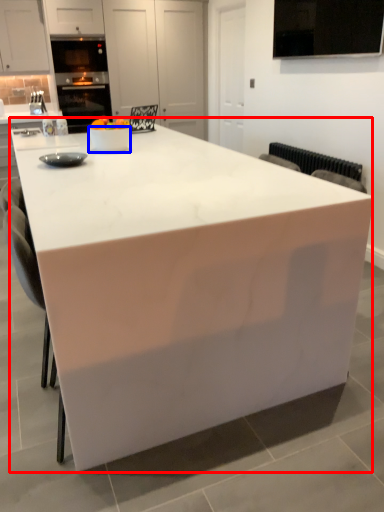
Question: Which object appears farthest to the camera in this image, table (highlighted by a red box) or bowl (highlighted by a blue box)?

Choices:
 (A) table
 (B) bowl

Answer: (B)